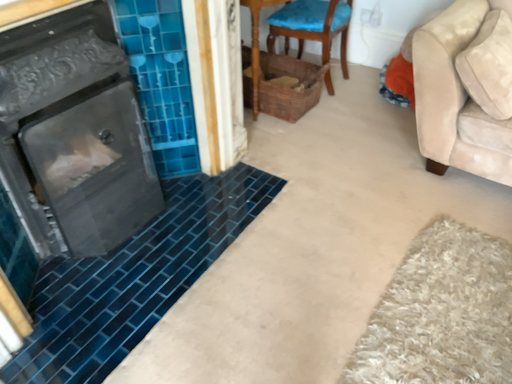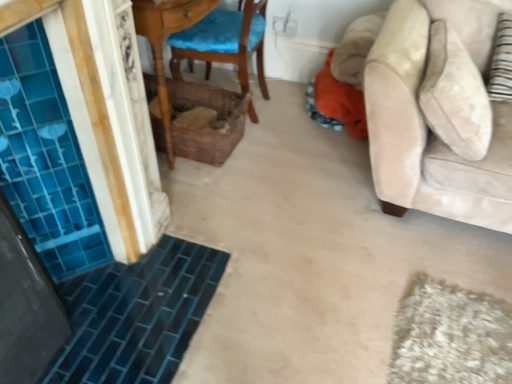
Question: How did the camera likely rotate when shooting the video?

Choices:
 (A) rotated left
 (B) rotated right

Answer: (B)